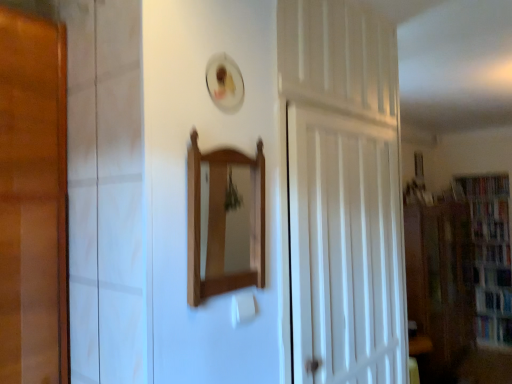
Question: Should I look upward or downward to see light brown wood mirror at center?

Choices:
 (A) up
 (B) down

Answer: (B)

Question: Considering the relative sizes of hardcover book at right, positioned as the fourth book in top-to-bottom order, and hardcover book at right, the 3th book from the top, in the image provided, is hardcover book at right, positioned as the fourth book in top-to-bottom order, wider than hardcover book at right, the 3th book from the top,?

Choices:
 (A) no
 (B) yes

Answer: (B)

Question: Does hardcover book at right, positioned as the fourth book in top-to-bottom order, have a smaller size compared to hardcover book at right, the 3th book from the top?

Choices:
 (A) yes
 (B) no

Answer: (B)

Question: Is hardcover book at right, positioned as the fourth book in top-to-bottom order, beside hardcover book at right, the 3th book from the top?

Choices:
 (A) no
 (B) yes

Answer: (A)

Question: Is hardcover book at right, arranged as the 1th book when ordered from the bottom, positioned beyond the bounds of hardcover book at right, the 3th book from the top?

Choices:
 (A) yes
 (B) no

Answer: (A)

Question: Considering the relative positions of hardcover book at right, positioned as the fourth book in top-to-bottom order, and hardcover book at right, acting as the second book starting from the bottom, in the image provided, is hardcover book at right, positioned as the fourth book in top-to-bottom order, to the right of hardcover book at right, acting as the second book starting from the bottom, from the viewer's perspective?

Choices:
 (A) yes
 (B) no

Answer: (A)

Question: Is hardcover book at right, arranged as the 1th book when ordered from the bottom, behind hardcover book at right, the 3th book from the top?

Choices:
 (A) no
 (B) yes

Answer: (A)

Question: From a real-world perspective, is white wooden door at center over transparent glass cabinet at right?

Choices:
 (A) yes
 (B) no

Answer: (A)

Question: Is white wooden door at center far away from transparent glass cabinet at right?

Choices:
 (A) no
 (B) yes

Answer: (B)

Question: Can you confirm if white wooden door at center is wider than transparent glass cabinet at right?

Choices:
 (A) yes
 (B) no

Answer: (B)

Question: Considering the relative sizes of white wooden door at center and transparent glass cabinet at right in the image provided, is white wooden door at center smaller than transparent glass cabinet at right?

Choices:
 (A) no
 (B) yes

Answer: (B)

Question: Would you say white wooden door at center is outside transparent glass cabinet at right?

Choices:
 (A) yes
 (B) no

Answer: (A)

Question: Could you tell me if white wooden door at center is facing transparent glass cabinet at right?

Choices:
 (A) no
 (B) yes

Answer: (A)

Question: From a real-world perspective, is hardcover book at right, the 4th book ordered from the bottom, physically below wooden bookcase at right?

Choices:
 (A) yes
 (B) no

Answer: (B)